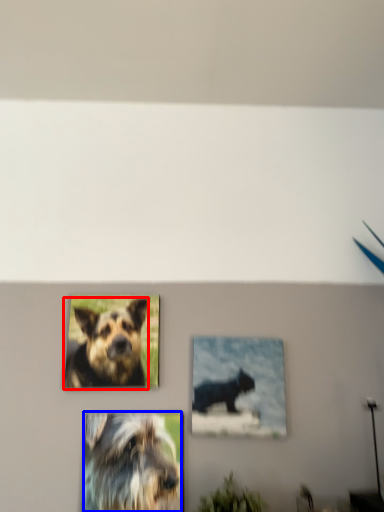
Question: Which of the following is the closest to the observer, dog (highlighted by a red box) or dog (highlighted by a blue box)?

Choices:
 (A) dog
 (B) dog

Answer: (B)